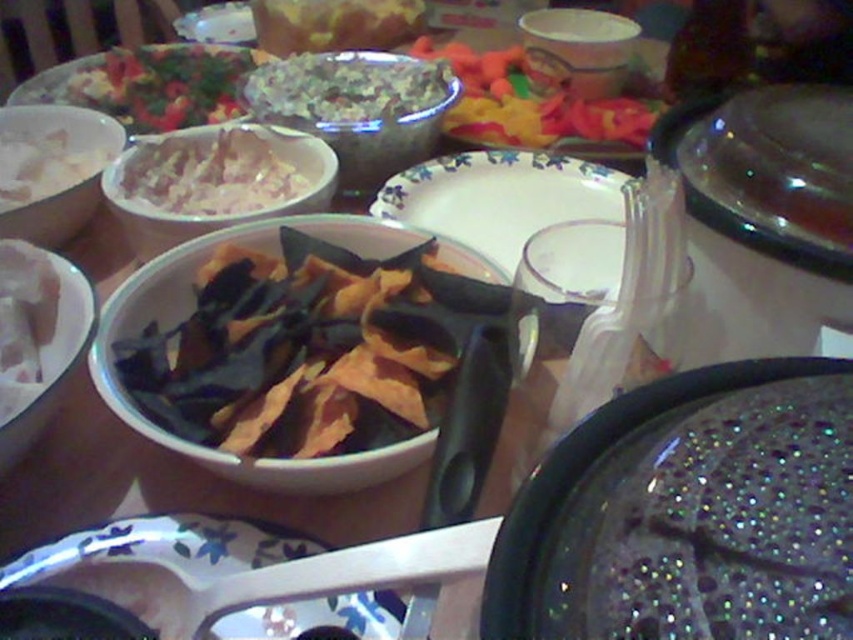
Measure the distance between matte white bowl at center and white floral plate at center.

matte white bowl at center and white floral plate at center are 6.13 inches apart from each other.

Is matte white bowl at center to the right of white floral plate at center from the viewer's perspective?

Incorrect, matte white bowl at center is not on the right side of white floral plate at center.

Between point (126, 216) and point (485, 173), which one is positioned in front?

Point (126, 216) is more forward.

Locate an element on the screen. matte white bowl at center is located at coordinates (215, 182).

Image resolution: width=853 pixels, height=640 pixels. What are the coordinates of `shiny green salad at upper left` in the screenshot? It's located at (164, 84).

Does shiny green salad at upper left have a lesser height compared to white matte bowl at upper left?

In fact, shiny green salad at upper left may be taller than white matte bowl at upper left.

Who is more forward, (126, 77) or (68, 124)?

Point (68, 124) is in front.

Where is `shiny green salad at upper left`? shiny green salad at upper left is located at coordinates (164, 84).

Can you confirm if white floral plate at center is positioned below matte white bowl at upper center?

Indeed, white floral plate at center is positioned under matte white bowl at upper center.

Between point (463, 202) and point (573, 33), which one is positioned in front?

Point (463, 202) is in front.

You are a GUI agent. You are given a task and a screenshot of the screen. Output one action in this format:
    pyautogui.click(x=<x>, y=<y>)
    Task: Click on the white floral plate at center
    
    Given the screenshot: What is the action you would take?
    click(500, 196)